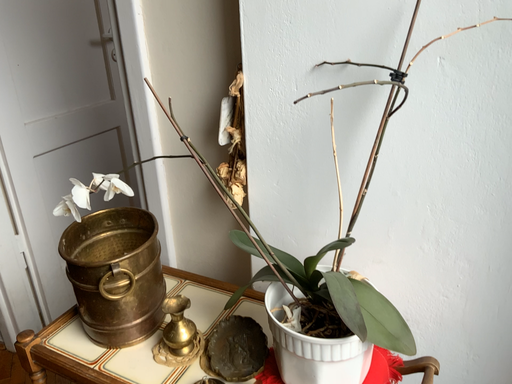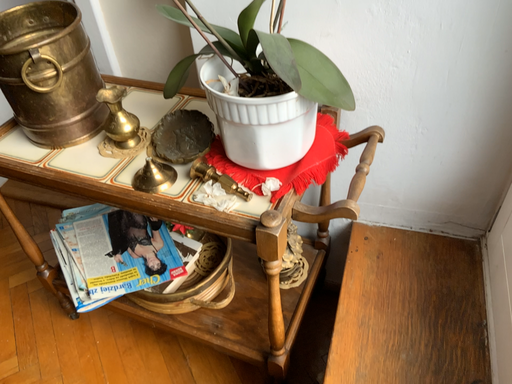
Question: Which way did the camera rotate in the video?

Choices:
 (A) rotated downward
 (B) rotated upward

Answer: (A)